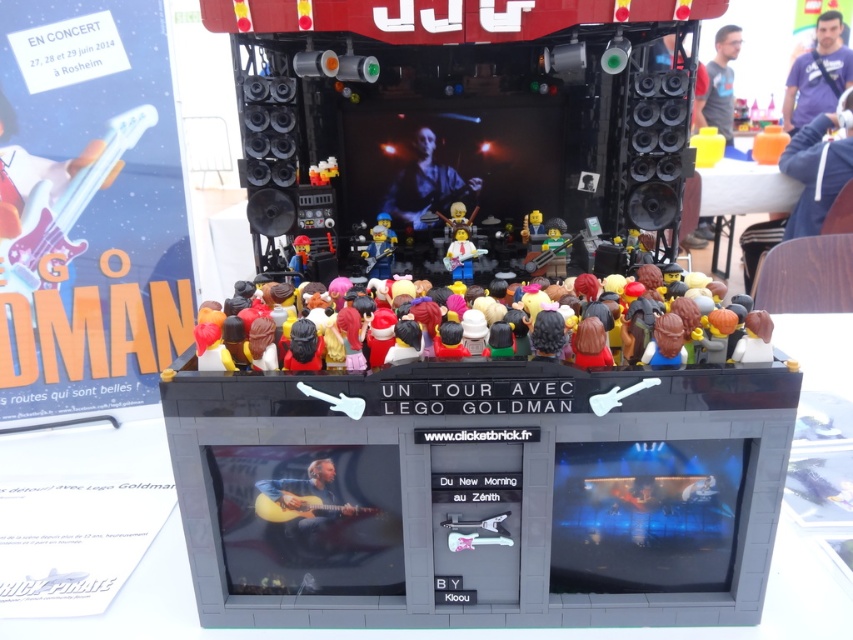
You are a photographer positioned at the center of the stage. You want to take a photo of the gray fabric shirt at upper right. Based on its coordinates, in which direction should you move your camera to capture it?

The gray fabric shirt at upper right is located at coordinates point [718,84]. Since the photographer is at the center of the stage, moving the camera slightly to the upper right direction would align it with the gray fabric shirt at upper right.

You are a photographer positioned at the center of the stage. You notice a gray fabric shirt at upper right in the crowd. Where should you aim your camera to capture the shirt in the frame?

The gray fabric shirt at upper right is located at point (718, 84), so you should aim your camera towards the upper right direction to capture it.